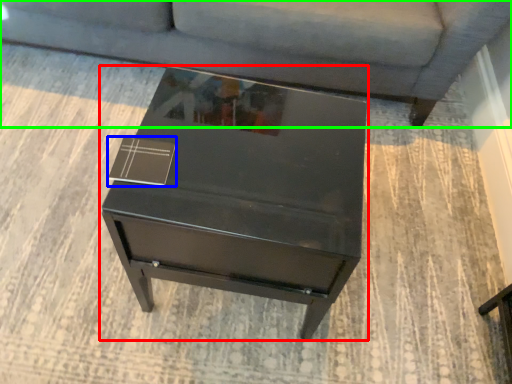
Question: Estimate the real-world distances between objects in this image. Which object is farther from table (highlighted by a red box), square (highlighted by a blue box) or studio couch (highlighted by a green box)?

Choices:
 (A) square
 (B) studio couch

Answer: (B)